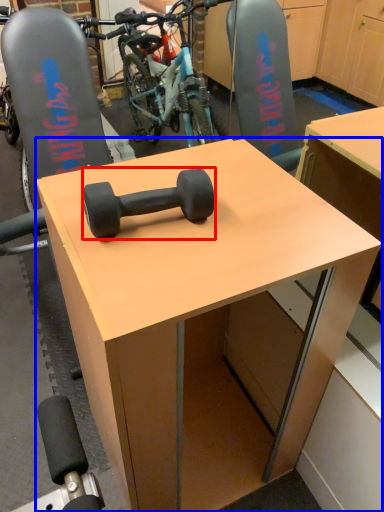
Question: Among these objects, which one is farthest to the camera, dumbbell (highlighted by a red box) or desk (highlighted by a blue box)?

Choices:
 (A) dumbbell
 (B) desk

Answer: (A)